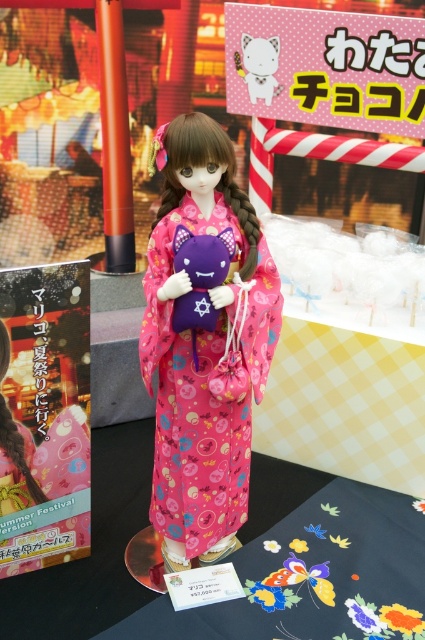
Can you confirm if pink satin kimono at center is positioned to the left of white matte plush cat at center?

Yes, pink satin kimono at center is to the left of white matte plush cat at center.

Locate an element on the screen. pink satin kimono at center is located at coordinates pos(204,340).